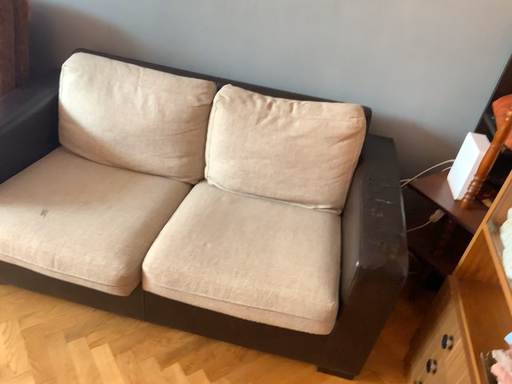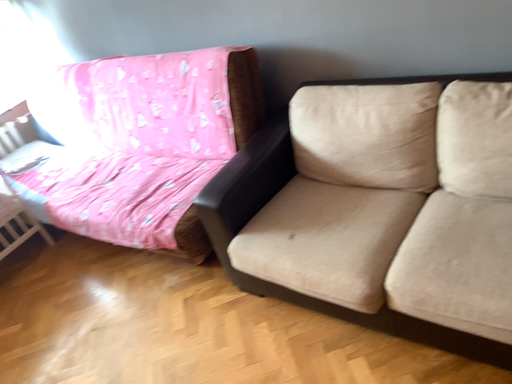
Question: Which way did the camera rotate in the video?

Choices:
 (A) rotated left
 (B) rotated right

Answer: (A)